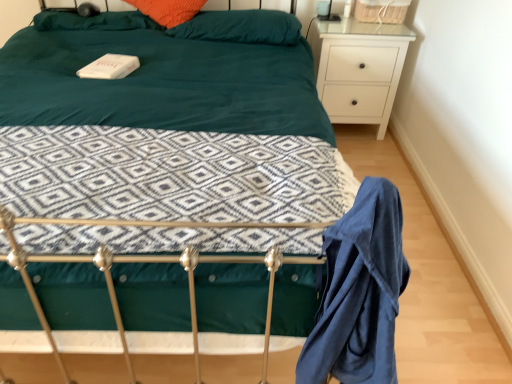
Question: Is blue cotton robe at lower right far from teal fabric bed at center?

Choices:
 (A) yes
 (B) no

Answer: (B)

Question: Does blue cotton robe at lower right come behind teal fabric bed at center?

Choices:
 (A) yes
 (B) no

Answer: (A)

Question: Could teal fabric bed at center be considered to be inside blue cotton robe at lower right?

Choices:
 (A) no
 (B) yes

Answer: (A)

Question: Does blue cotton robe at lower right have a larger size compared to teal fabric bed at center?

Choices:
 (A) no
 (B) yes

Answer: (A)

Question: Does blue cotton robe at lower right have a lesser width compared to teal fabric bed at center?

Choices:
 (A) no
 (B) yes

Answer: (B)

Question: Is point (133, 21) closer or farther from the camera than point (352, 74)?

Choices:
 (A) closer
 (B) farther

Answer: (A)

Question: In the image, is orange fabric pillow at upper center, which is the second pillow from right to left, positioned in front of or behind white matte nightstand at upper right?

Choices:
 (A) front
 (B) behind

Answer: (A)

Question: Is orange fabric pillow at upper center, which is the second pillow from right to left, taller or shorter than white matte nightstand at upper right?

Choices:
 (A) short
 (B) tall

Answer: (A)

Question: From the image's perspective, is orange fabric pillow at upper center, the 1th pillow viewed from the left, above or below white matte nightstand at upper right?

Choices:
 (A) below
 (B) above

Answer: (B)

Question: In terms of width, does white matte nightstand at upper right look wider or thinner when compared to orange fabric pillow at upper center, which is the second pillow from right to left?

Choices:
 (A) wide
 (B) thin

Answer: (B)

Question: From a real-world perspective, relative to orange fabric pillow at upper center, the 1th pillow viewed from the left, is white matte nightstand at upper right vertically above or below?

Choices:
 (A) below
 (B) above

Answer: (A)

Question: Relative to orange fabric pillow at upper center, which is the second pillow from right to left, is white matte nightstand at upper right in front or behind?

Choices:
 (A) behind
 (B) front

Answer: (A)

Question: Is white matte nightstand at upper right bigger or smaller than orange fabric pillow at upper center, which is the second pillow from right to left?

Choices:
 (A) big
 (B) small

Answer: (A)

Question: From the image's perspective, is teal fabric bed at center above or below teal fabric pillow at upper center, arranged as the first pillow when viewed from the right?

Choices:
 (A) below
 (B) above

Answer: (A)

Question: Considering the positions of teal fabric bed at center and teal fabric pillow at upper center, positioned as the 2th pillow in left-to-right order, in the image, is teal fabric bed at center wider or thinner than teal fabric pillow at upper center, positioned as the 2th pillow in left-to-right order,?

Choices:
 (A) thin
 (B) wide

Answer: (B)